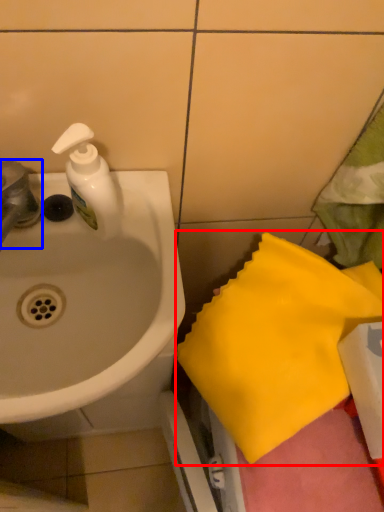
Question: Which object is further to the camera taking this photo, beach towel (highlighted by a red box) or tap (highlighted by a blue box)?

Choices:
 (A) beach towel
 (B) tap

Answer: (B)